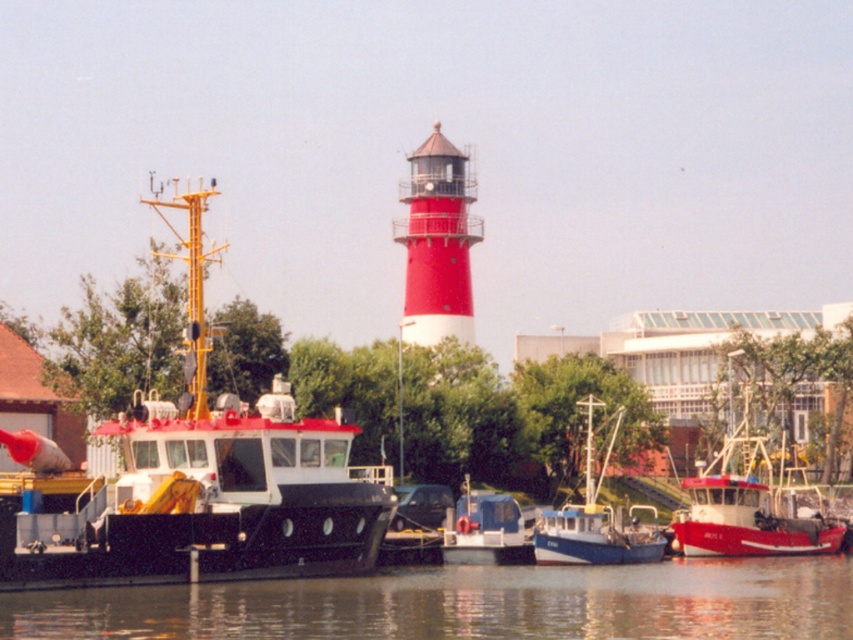
Consider the image. Between matte black boat at left and blue matte boat at center, which one is positioned higher?

matte black boat at left is higher up.

Who is shorter, matte black boat at left or blue matte boat at center?

Standing shorter between the two is blue matte boat at center.

Identify the location of matte black boat at left. The height and width of the screenshot is (640, 853). (193, 484).

Measure the distance between transparent water at lower center and blue matte boat at center.

transparent water at lower center and blue matte boat at center are 15.13 meters apart from each other.

Is transparent water at lower center wider than blue matte boat at center?

Correct, the width of transparent water at lower center exceeds that of blue matte boat at center.

The image size is (853, 640). What do you see at coordinates (469, 604) in the screenshot?
I see `transparent water at lower center` at bounding box center [469, 604].

This screenshot has height=640, width=853. What are the coordinates of `transparent water at lower center` in the screenshot? It's located at (469, 604).

Between red painted metal lighthouse at center and blue plastic boat at center, which one is positioned higher?

red painted metal lighthouse at center

Is red painted metal lighthouse at center to the left of blue plastic boat at center from the viewer's perspective?

Yes, red painted metal lighthouse at center is to the left of blue plastic boat at center.

At what (x,y) coordinates should I click in order to perform the action: click on red painted metal lighthouse at center. Please return your answer as a coordinate pair (x, y). Image resolution: width=853 pixels, height=640 pixels. Looking at the image, I should click on (437, 243).